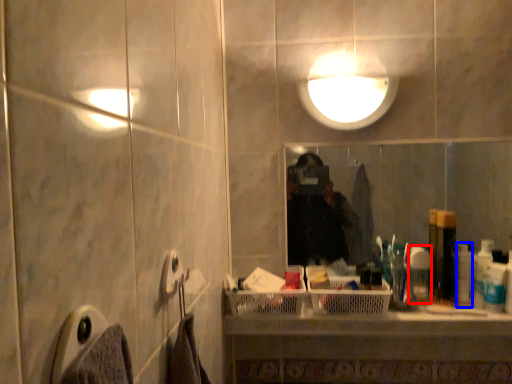
Question: Which point is closer to the camera, toiletry (highlighted by a red box) or toiletry (highlighted by a blue box)?

Choices:
 (A) toiletry
 (B) toiletry

Answer: (B)